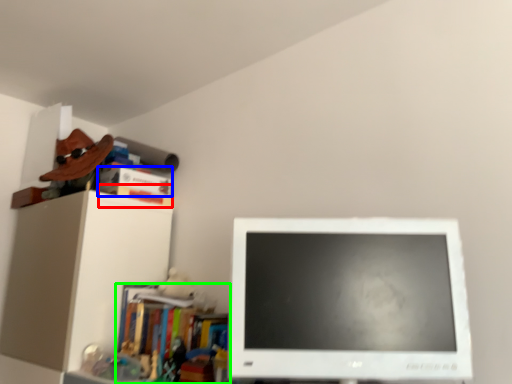
Question: Estimate the real-world distances between objects in this image. Which object is farther from book (highlighted by a red box), book (highlighted by a blue box) or book (highlighted by a green box)?

Choices:
 (A) book
 (B) book

Answer: (B)